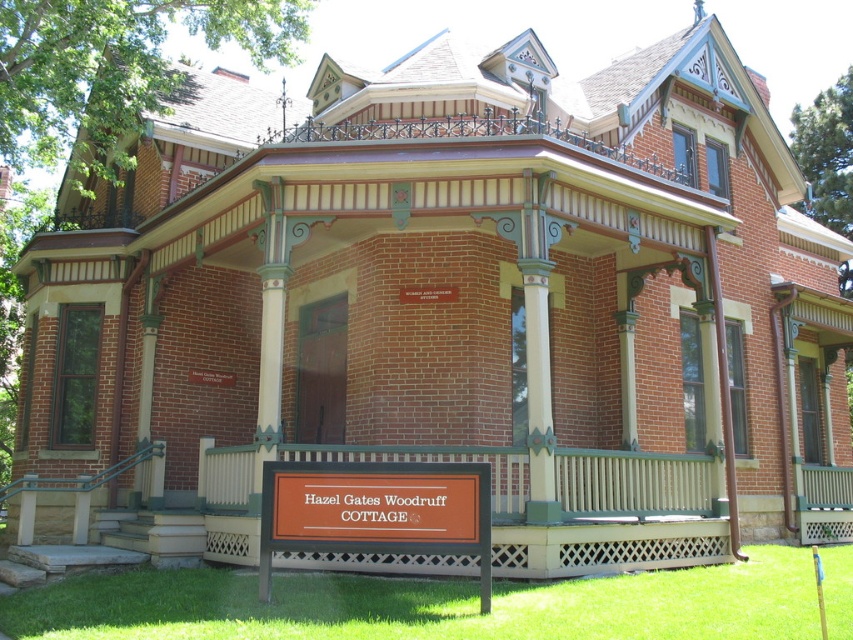
You are standing at the entrance of Hazel Gates Woodruff Cottage and want to step onto the wooden porch at lower center. Based on the coordinates provided, can you determine if the porch is directly in front of you?

The wooden porch at lower center is located at point (579, 504), which is directly in front of you, so yes, you can step onto it directly.

You are standing in front of the Victorian cottage and want to enter through the main door. The orange matte sign at lower center indicates the entrance. Is the wooden porch at lower center located above or below the sign?

The wooden porch at lower center is positioned under the orange matte sign at lower center, so it is located below the sign.

You are standing in front of the cottage and want to read the orange matte sign at lower center. Is the wooden porch at lower center blocking your view of the sign?

The orange matte sign at lower center is behind the wooden porch at lower center, so the wooden porch at lower center is blocking your view of the sign.